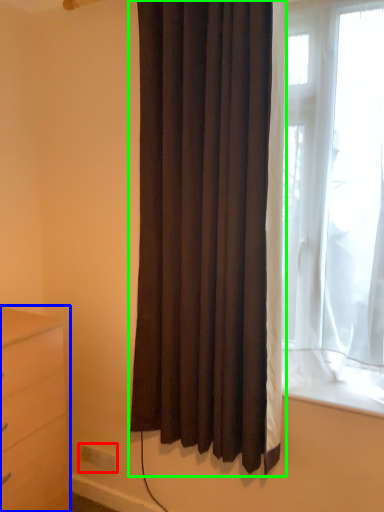
Question: Considering the real-world distances, which object is closest to electric outlet (highlighted by a red box)? chest of drawers (highlighted by a blue box) or curtain (highlighted by a green box).

Choices:
 (A) chest of drawers
 (B) curtain

Answer: (A)